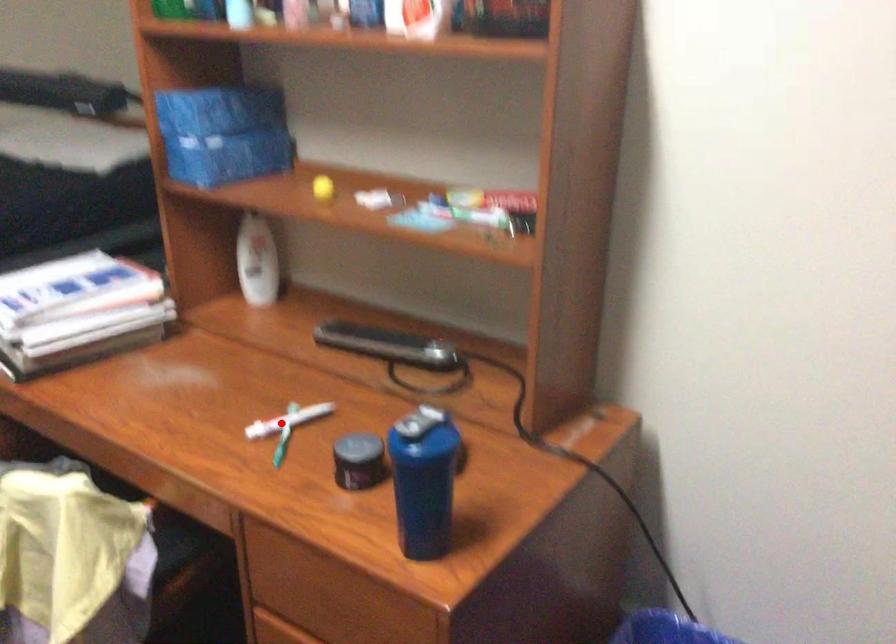
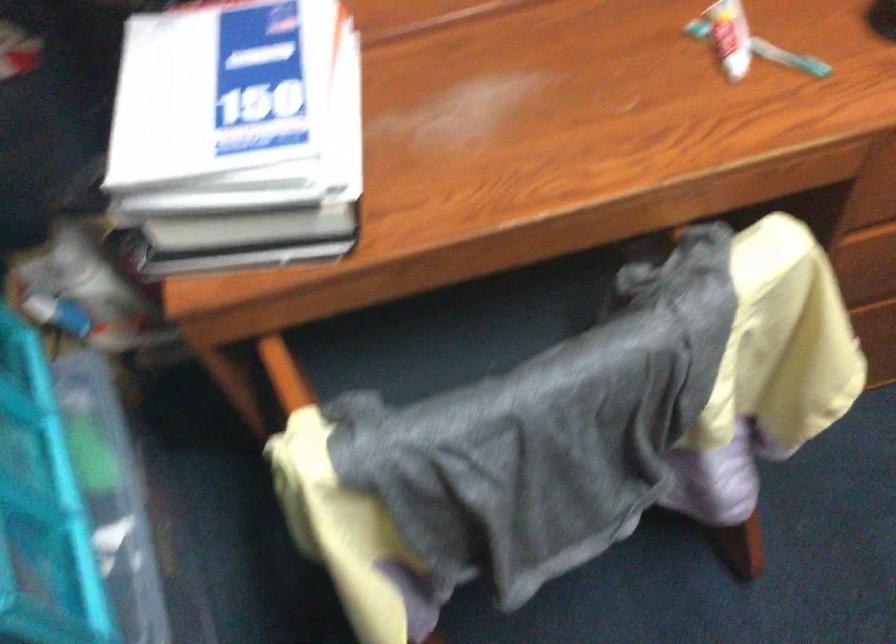
Question: I am providing you with two images of the same scene from different viewpoints. Image1 has a red point marked. In image2, the corresponding 3D location appears at what relative position? Reply with the corresponding letter.

Choices:
 (A) Closer
 (B) Farther

Answer: (A)